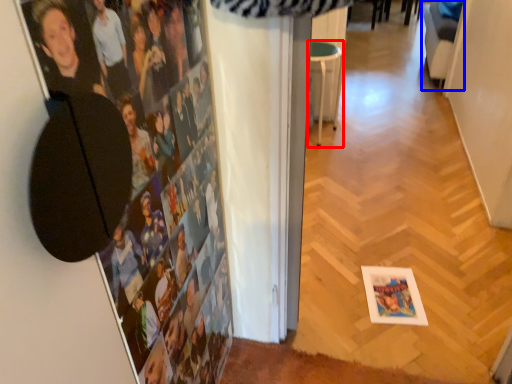
Question: Which point is closer to the camera, furniture (highlighted by a red box) or swivel chair (highlighted by a blue box)?

Choices:
 (A) furniture
 (B) swivel chair

Answer: (A)